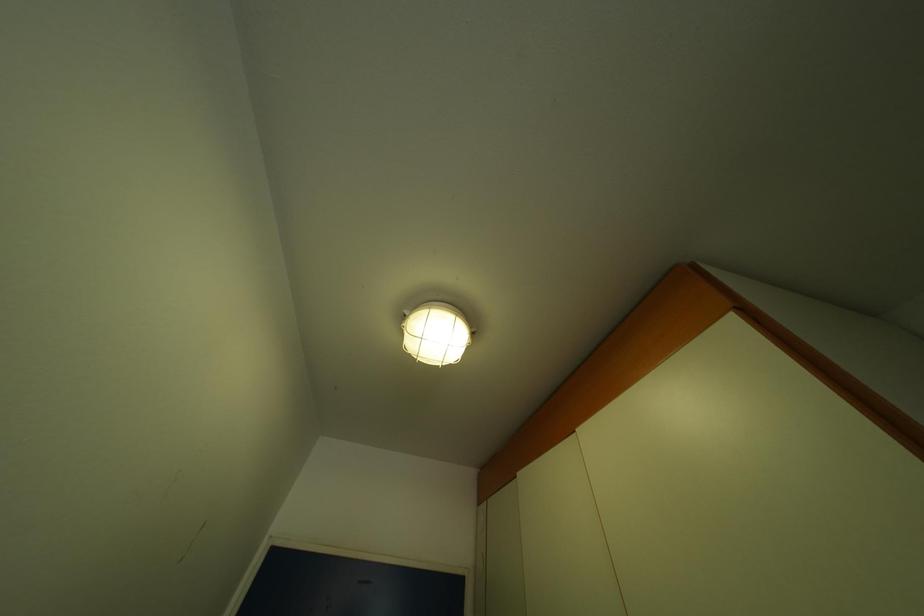
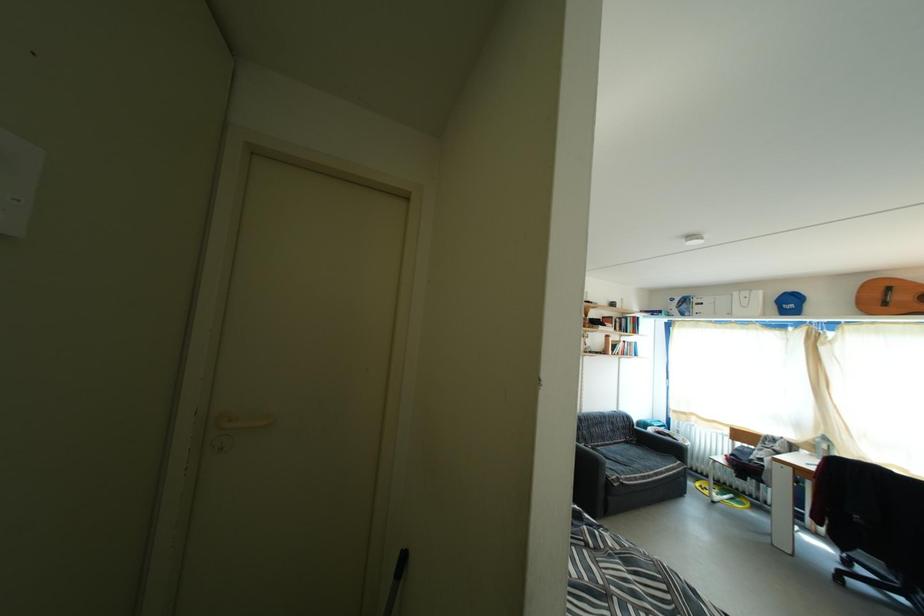
Question: How did the camera likely rotate?

Choices:
 (A) Left
 (B) Right
 (C) Up
 (D) Down

Answer: (B)